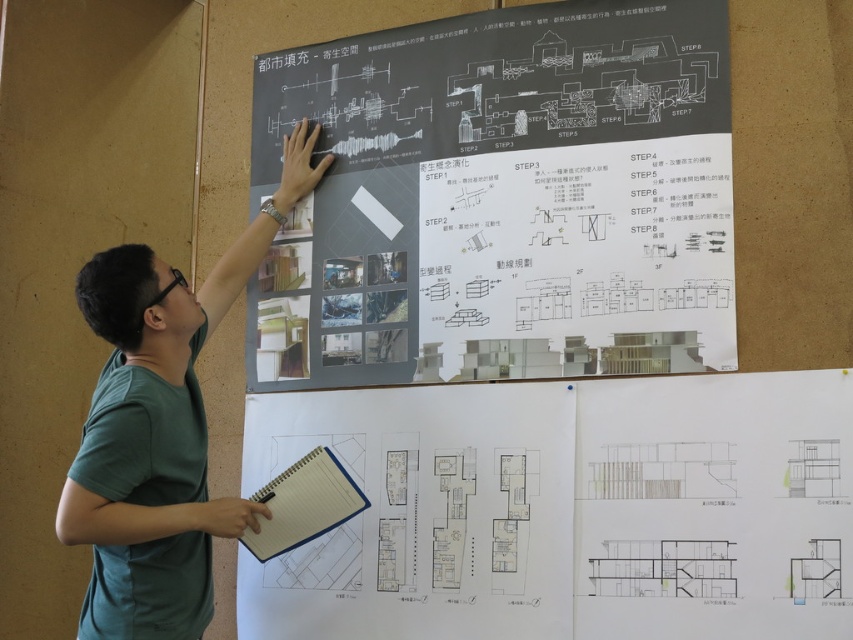
Who is positioned more to the left, green t-shirt at upper left or blue spiral notebook at lower center?

From the viewer's perspective, green t-shirt at upper left appears more on the left side.

What do you see at coordinates (160, 428) in the screenshot?
I see `green t-shirt at upper left` at bounding box center [160, 428].

The height and width of the screenshot is (640, 853). Find the location of `green t-shirt at upper left`. green t-shirt at upper left is located at coordinates (160, 428).

Is point (450, 560) positioned after point (196, 593)?

Yes, point (450, 560) is behind point (196, 593).

At what (x,y) coordinates should I click in order to perform the action: click on white paper at lower center. Please return your answer as a coordinate pair (x, y). Looking at the image, I should click on (566, 509).

Which is above, gray matte poster at upper center or white paper at lower center?

gray matte poster at upper center

Is gray matte poster at upper center to the left of white paper at lower center from the viewer's perspective?

Yes, gray matte poster at upper center is to the left of white paper at lower center.

Measure the distance between gray matte poster at upper center and camera.

gray matte poster at upper center is 1.97 meters away from camera.

Locate an element on the screen. Image resolution: width=853 pixels, height=640 pixels. gray matte poster at upper center is located at coordinates (502, 198).